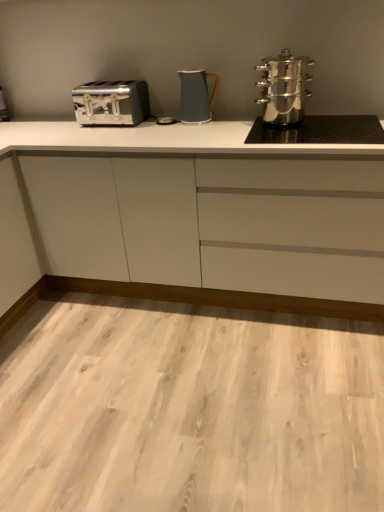
Question: Is satin chrome toaster at left at the left side of white matte cabinet at center?

Choices:
 (A) yes
 (B) no

Answer: (A)

Question: Is satin chrome toaster at left oriented away from white matte cabinet at center?

Choices:
 (A) yes
 (B) no

Answer: (B)

Question: Is satin chrome toaster at left bigger than white matte cabinet at center?

Choices:
 (A) no
 (B) yes

Answer: (A)

Question: From a real-world perspective, does satin chrome toaster at left stand above white matte cabinet at center?

Choices:
 (A) no
 (B) yes

Answer: (B)

Question: Considering the relative sizes of satin chrome toaster at left and white matte cabinet at center in the image provided, is satin chrome toaster at left taller than white matte cabinet at center?

Choices:
 (A) no
 (B) yes

Answer: (A)

Question: Is white matte cabinet at center bigger or smaller than satin silver toaster at left?

Choices:
 (A) small
 (B) big

Answer: (B)

Question: In the image, is white matte cabinet at center positioned in front of or behind satin silver toaster at left?

Choices:
 (A) behind
 (B) front

Answer: (B)

Question: Based on their positions, is white matte cabinet at center located to the left or right of satin silver toaster at left?

Choices:
 (A) right
 (B) left

Answer: (A)

Question: In terms of width, does white matte cabinet at center look wider or thinner when compared to satin silver toaster at left?

Choices:
 (A) wide
 (B) thin

Answer: (A)

Question: Based on their sizes in the image, would you say satin silver toaster at left is bigger or smaller than matte blue pitcher at center, arranged as the second kitchen appliance when viewed from the right?

Choices:
 (A) small
 (B) big

Answer: (A)

Question: From the image's perspective, is satin silver toaster at left located above or below matte blue pitcher at center, marked as the first kitchen appliance in a left-to-right arrangement?

Choices:
 (A) below
 (B) above

Answer: (B)

Question: Visually, is satin silver toaster at left positioned to the left or to the right of matte blue pitcher at center, arranged as the second kitchen appliance when viewed from the right?

Choices:
 (A) left
 (B) right

Answer: (A)

Question: In the image, is satin silver toaster at left positioned in front of or behind matte blue pitcher at center, arranged as the second kitchen appliance when viewed from the right?

Choices:
 (A) front
 (B) behind

Answer: (B)

Question: From the image's perspective, is white matte cabinet at center above or below polished stainless steel steamer at right, which is counted as the 1th kitchen appliance, starting from the right?

Choices:
 (A) above
 (B) below

Answer: (B)

Question: In terms of height, does white matte cabinet at center look taller or shorter compared to polished stainless steel steamer at right, which is counted as the 1th kitchen appliance, starting from the right?

Choices:
 (A) tall
 (B) short

Answer: (A)